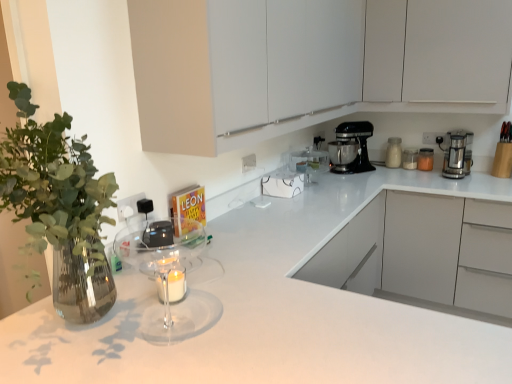
Describe the element at coordinates (425, 159) in the screenshot. This screenshot has height=384, width=512. I see `translucent glass jar at upper right, the second kitchen appliance in the right-to-left sequence` at that location.

This screenshot has width=512, height=384. In order to click on white glossy countertop at center in this screenshot , I will do `click(270, 311)`.

This screenshot has width=512, height=384. Describe the element at coordinates (168, 284) in the screenshot. I see `transparent glass mixer at center` at that location.

How much space does white matte cabinet at upper center, arranged as the 1th cabinetry when viewed from the back, occupy horizontally?

14.37 inches.

At what (x,y) coordinates should I click in order to perform the action: click on white glossy jar at upper right, the third kitchen appliance from the right. Please return your answer as a coordinate pair (x, y). Looking at the image, I should click on (393, 152).

The width and height of the screenshot is (512, 384). Identify the location of black metallic stand mixer at upper right, the 1th kitchen appliance when ordered from left to right. (351, 148).

The image size is (512, 384). Describe the element at coordinates (456, 155) in the screenshot. I see `satin silver coffee maker at right, which ranks as the first kitchen appliance in right-to-left order` at that location.

The image size is (512, 384). I want to click on translucent glass jar at upper right, acting as the 3th kitchen appliance starting from the left, so click(x=425, y=159).

Measure the distance between transparent glass mixer at center and white glossy jar at upper right, the third kitchen appliance from the right.

transparent glass mixer at center is 6.84 feet from white glossy jar at upper right, the third kitchen appliance from the right.

The image size is (512, 384). Identify the location of mixer below the white glossy jar at upper right, which is the 2th kitchen appliance from left to right (from the image's perspective). (168, 284).

Is transparent glass mixer at center shorter than white glossy jar at upper right, which is the 2th kitchen appliance from left to right?

No.

Would you consider transparent glass mixer at center to be distant from white glossy jar at upper right, which is the 2th kitchen appliance from left to right?

Yes, transparent glass mixer at center is far from white glossy jar at upper right, which is the 2th kitchen appliance from left to right.

Considering the relative sizes of satin silver coffee maker at right, which ranks as the first kitchen appliance in right-to-left order, and white matte cabinet at upper center, which is the first cabinetry in front-to-back order, in the image provided, is satin silver coffee maker at right, which ranks as the first kitchen appliance in right-to-left order, taller than white matte cabinet at upper center, which is the first cabinetry in front-to-back order,?

No.

Considering the sizes of objects satin silver coffee maker at right, which ranks as the first kitchen appliance in right-to-left order, and white matte cabinet at upper center, which is the first cabinetry in front-to-back order, in the image provided, who is smaller, satin silver coffee maker at right, which ranks as the first kitchen appliance in right-to-left order, or white matte cabinet at upper center, which is the first cabinetry in front-to-back order,?

satin silver coffee maker at right, which ranks as the first kitchen appliance in right-to-left order.

From the image's perspective, count 1st cabinetrys upward from the satin silver coffee maker at right, which ranks as the first kitchen appliance in right-to-left order, and point to it. Please provide its 2D coordinates.

[(211, 71)]

Can you confirm if satin silver coffee maker at right, placed as the 4th kitchen appliance when sorted from left to right, is thinner than white matte cabinet at upper center, the second cabinetry when ordered from back to front?

Correct, the width of satin silver coffee maker at right, placed as the 4th kitchen appliance when sorted from left to right, is less than that of white matte cabinet at upper center, the second cabinetry when ordered from back to front.

From their relative heights in the image, would you say white glossy jar at upper right, which is the 2th kitchen appliance from left to right, is taller or shorter than translucent glass jar at upper right, acting as the 3th kitchen appliance starting from the left?

Clearly, white glossy jar at upper right, which is the 2th kitchen appliance from left to right, is taller compared to translucent glass jar at upper right, acting as the 3th kitchen appliance starting from the left.

Can you tell me how much white glossy jar at upper right, which is the 2th kitchen appliance from left to right, and translucent glass jar at upper right, acting as the 3th kitchen appliance starting from the left, differ in facing direction?

4.46 degrees.

Which object is further away from the camera, white glossy jar at upper right, the third kitchen appliance from the right, or translucent glass jar at upper right, acting as the 3th kitchen appliance starting from the left?

white glossy jar at upper right, the third kitchen appliance from the right, is further away from the camera.

Is point (400, 144) closer or farther from the camera than point (426, 154)?

Point (400, 144) is positioned farther from the camera compared to point (426, 154).

From a real-world perspective, is white glossy jar at upper right, which is the 2th kitchen appliance from left to right, below white glossy countertop at center?

No, from a real-world perspective, white glossy jar at upper right, which is the 2th kitchen appliance from left to right, is not under white glossy countertop at center.

Which is more to the left, white glossy jar at upper right, which is the 2th kitchen appliance from left to right, or white glossy countertop at center?

From the viewer's perspective, white glossy countertop at center appears more on the left side.

Find the location of a particular element. This screenshot has height=384, width=512. the 4th kitchen appliance behind the white glossy countertop at center is located at coordinates (393, 152).

Considering the relative positions of white glossy jar at upper right, the third kitchen appliance from the right, and white glossy countertop at center in the image provided, is white glossy jar at upper right, the third kitchen appliance from the right, in front of white glossy countertop at center?

No.

Is transparent glass mixer at center oriented away from white glossy countertop at center?

Yes, transparent glass mixer at center's orientation is away from white glossy countertop at center.

Is transparent glass mixer at center not inside white glossy countertop at center?

No.

Which point is more forward, (x=206, y=305) or (x=128, y=294)?

The point (x=206, y=305) is in front.

How much distance is there between transparent glass mixer at center and white glossy countertop at center?

They are 7.84 inches apart.

From the image's perspective, is satin silver coffee maker at right, which ranks as the first kitchen appliance in right-to-left order, positioned above or below white glossy jar at upper right, which is the 2th kitchen appliance from left to right?

Based on their image positions, satin silver coffee maker at right, which ranks as the first kitchen appliance in right-to-left order, is located beneath white glossy jar at upper right, which is the 2th kitchen appliance from left to right.

Looking at this image, does satin silver coffee maker at right, which ranks as the first kitchen appliance in right-to-left order, appear on the left side of white glossy jar at upper right, which is the 2th kitchen appliance from left to right?

No.

Choose the correct answer: Is satin silver coffee maker at right, which ranks as the first kitchen appliance in right-to-left order, inside white glossy jar at upper right, which is the 2th kitchen appliance from left to right, or outside it?

The correct answer is: outside.

From a real-world perspective, is white matte cabinet at upper center, the second cabinetry when ordered from back to front, located beneath satin silver coffee maker at right, which ranks as the first kitchen appliance in right-to-left order?

No.

Does point (156, 25) lie in front of point (444, 157)?

That is True.

Is white matte cabinet at upper center, which is the first cabinetry in front-to-back order, oriented towards satin silver coffee maker at right, which ranks as the first kitchen appliance in right-to-left order?

No, white matte cabinet at upper center, which is the first cabinetry in front-to-back order, is not facing towards satin silver coffee maker at right, which ranks as the first kitchen appliance in right-to-left order.

Considering the positions of objects white matte cabinet at upper center, the second cabinetry when ordered from back to front, and satin silver coffee maker at right, which ranks as the first kitchen appliance in right-to-left order, in the image provided, who is more to the right, white matte cabinet at upper center, the second cabinetry when ordered from back to front, or satin silver coffee maker at right, which ranks as the first kitchen appliance in right-to-left order,?

satin silver coffee maker at right, which ranks as the first kitchen appliance in right-to-left order, is more to the right.

I want to click on the 1st kitchen appliance below the transparent glass mixer at center (from a real-world perspective), so click(393, 152).

Locate an element on the screen. The height and width of the screenshot is (384, 512). the 2nd cabinetry positioned above the satin silver coffee maker at right, placed as the 4th kitchen appliance when sorted from left to right (from a real-world perspective) is located at coordinates (211, 71).

From the image, which object appears to be farther from white glossy countertop at center, white glossy jar at upper right, the third kitchen appliance from the right, or translucent glass jar at upper right, the second kitchen appliance in the right-to-left sequence?

The object further to white glossy countertop at center is white glossy jar at upper right, the third kitchen appliance from the right.

From the image, which object appears to be farther from white glossy jar at upper right, the third kitchen appliance from the right, translucent glass jar at upper right, acting as the 3th kitchen appliance starting from the left, or black metallic stand mixer at upper right, the 1th kitchen appliance when ordered from left to right?

Among the two, black metallic stand mixer at upper right, the 1th kitchen appliance when ordered from left to right, is located further to white glossy jar at upper right, the third kitchen appliance from the right.

Based on their spatial positions, is translucent glass jar at upper right, the second kitchen appliance in the right-to-left sequence, or white matte cabinet at upper center, the second cabinetry when ordered from back to front, further from transparent glass mixer at center?

translucent glass jar at upper right, the second kitchen appliance in the right-to-left sequence.

When comparing their distances from white matte cabinet at upper center, the second cabinetry when ordered from back to front, does satin silver coffee maker at right, placed as the 4th kitchen appliance when sorted from left to right, or black metallic stand mixer at upper right, the 1th kitchen appliance when ordered from left to right, seem closer?

The object closer to white matte cabinet at upper center, the second cabinetry when ordered from back to front, is black metallic stand mixer at upper right, the 1th kitchen appliance when ordered from left to right.

Looking at the image, which one is located closer to white glossy countertop at center, satin silver coffee maker at right, placed as the 4th kitchen appliance when sorted from left to right, or transparent glass mixer at center?

transparent glass mixer at center is positioned closer to the anchor white glossy countertop at center.

Based on their spatial positions, is black metallic stand mixer at upper right, positioned as the fourth kitchen appliance in right-to-left order, or transparent glass mixer at center further from translucent glass jar at upper right, the second kitchen appliance in the right-to-left sequence?

transparent glass mixer at center.

In the scene shown: Considering their positions, is translucent glass jar at upper right, acting as the 3th kitchen appliance starting from the left, positioned further to white glossy jar at upper right, the third kitchen appliance from the right, than transparent glass mixer at center?

transparent glass mixer at center lies further to white glossy jar at upper right, the third kitchen appliance from the right, than the other object.

Looking at the image, which one is located closer to white matte cabinet at upper center, which is the first cabinetry in front-to-back order, transparent glass mixer at center or white glossy countertop at center?

transparent glass mixer at center is closer to white matte cabinet at upper center, which is the first cabinetry in front-to-back order.

Locate an element on the screen. This screenshot has height=384, width=512. mixer positioned between white matte cabinet at upper center, which is the first cabinetry in front-to-back order, and white matte cabinet at upper center, arranged as the 1th cabinetry when viewed from the back, from near to far is located at coordinates (168, 284).

Where is `cabinetry between white matte cabinet at upper center, which is the first cabinetry in front-to-back order, and white glossy jar at upper right, which is the 2th kitchen appliance from left to right, from front to back`? cabinetry between white matte cabinet at upper center, which is the first cabinetry in front-to-back order, and white glossy jar at upper right, which is the 2th kitchen appliance from left to right, from front to back is located at coordinates (438, 51).

The width and height of the screenshot is (512, 384). What are the coordinates of `cabinetry between transparent glass mixer at center and white glossy jar at upper right, which is the 2th kitchen appliance from left to right, from front to back` in the screenshot? It's located at (438, 51).

Where is `mixer between white glossy countertop at center and translucent glass jar at upper right, the second kitchen appliance in the right-to-left sequence, along the z-axis`? mixer between white glossy countertop at center and translucent glass jar at upper right, the second kitchen appliance in the right-to-left sequence, along the z-axis is located at coordinates (168, 284).